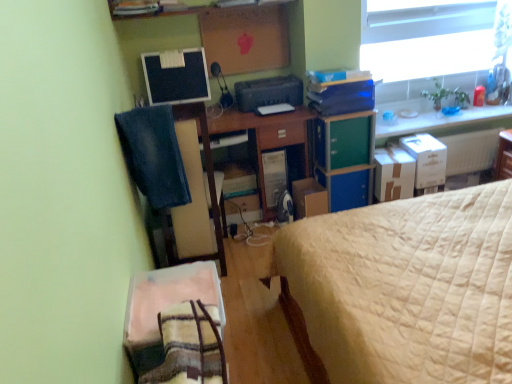
Question: From their relative heights in the image, would you say transparent glass window at upper right is taller or shorter than brown cardboard box at right, the second cardboard box viewed from the left?

Choices:
 (A) short
 (B) tall

Answer: (B)

Question: Is transparent glass window at upper right in front of or behind brown cardboard box at right, the second cardboard box viewed from the left, in the image?

Choices:
 (A) front
 (B) behind

Answer: (B)

Question: Estimate the real-world distances between objects in this image. Which object is closer to the satin black computer tower at center?

Choices:
 (A) white cardboard box at upper right, which ranks as the 3th cardboard box in left-to-right order
 (B) beige quilted bed at right
 (C) transparent glass window at upper right
 (D) wooden desk at center
 (E) denim at left

Answer: (D)

Question: Which object is the closest to the transparent glass window at upper right?

Choices:
 (A) cardboard box at center, the 3th cardboard box viewed from the right
 (B) beige quilted bed at right
 (C) matte black monitor at upper center
 (D) black plastic printer at center
 (E) plaid fabric blanket at lower left

Answer: (D)